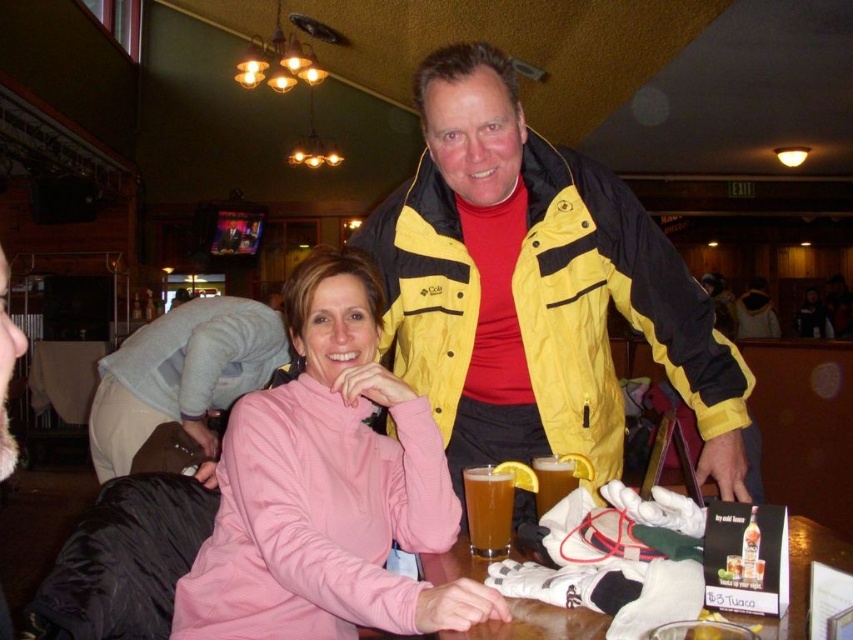
You are a customer sitting at the table in the image. You want to place your phone on the table but need to make sure it won not fall off the edge. Given that the phone is 15 cm long, can you determine if there is enough space between the gray fleece jacket at lower left and the edge of the table to place your phone?

The gray fleece jacket at lower left is positioned at point [181,376]. Without knowing the table dimensions or the distance to the edge, it is impossible to determine if there is enough space for the phone.